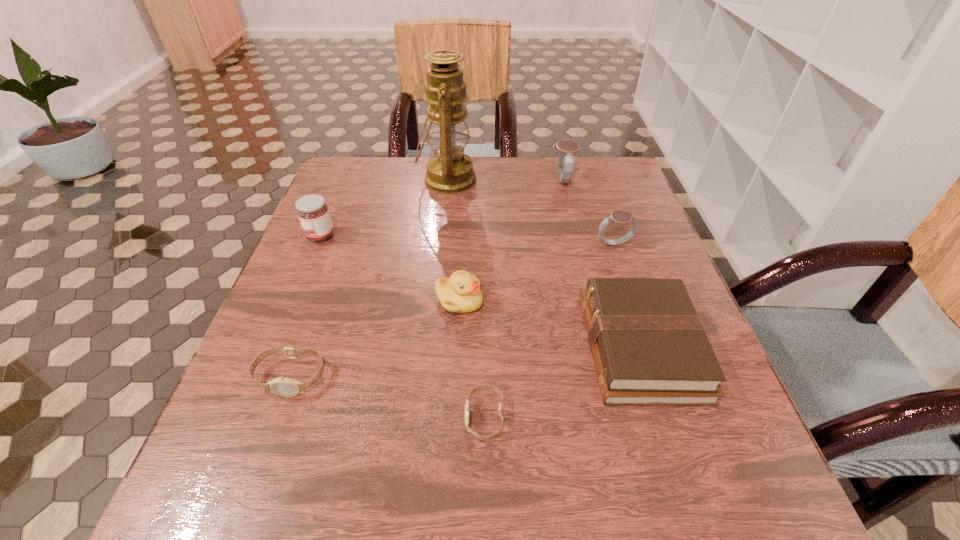
I want to click on free space at the far edge of the desktop, so click(x=394, y=200).

Identify the location of vacant area at the left edge. (328, 256).

Locate an element on the screen. Image resolution: width=960 pixels, height=540 pixels. vacant space at the right edge is located at coordinates (626, 255).

This screenshot has width=960, height=540. Find the location of `vacant space at the far left corner of the desktop`. vacant space at the far left corner of the desktop is located at coordinates (329, 194).

At what (x,y) coordinates should I click in order to perform the action: click on free location at the near left corner. Please return your answer as a coordinate pair (x, y). The image size is (960, 540). Looking at the image, I should click on (282, 511).

The height and width of the screenshot is (540, 960). In order to click on vacant region at the far right corner of the desktop in this screenshot , I will do `click(631, 181)`.

Where is `free point at the near right corner`? This screenshot has height=540, width=960. free point at the near right corner is located at coordinates coord(699,480).

The image size is (960, 540). In order to click on unoccupied area between the oil lamp and the rightmost watch in this screenshot , I will do `click(531, 212)`.

Where is `vacant space that's between the rightmost watch and the shortest watch`? vacant space that's between the rightmost watch and the shortest watch is located at coordinates (549, 330).

You are a GUI agent. You are given a task and a screenshot of the screen. Output one action in this format:
    pyautogui.click(x=<x>, y=<y>)
    Task: Click on the free spot between the yellow duckling and the second watch from right to left
    
    Given the screenshot: What is the action you would take?
    pyautogui.click(x=511, y=240)